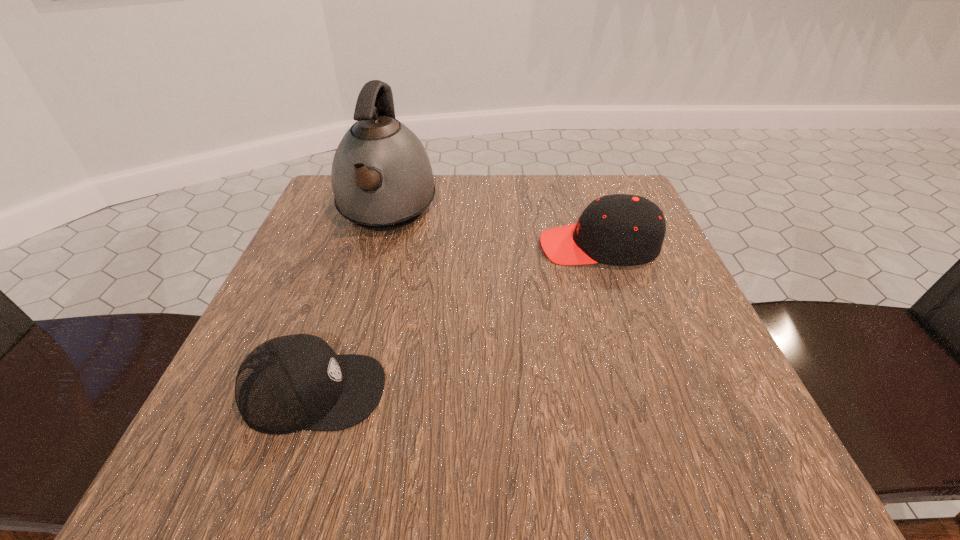
This screenshot has height=540, width=960. I want to click on free space that satisfies the following two spatial constraints: 1. at the spout of the tallest object; 2. on the front-facing side of the left cap, so click(x=334, y=392).